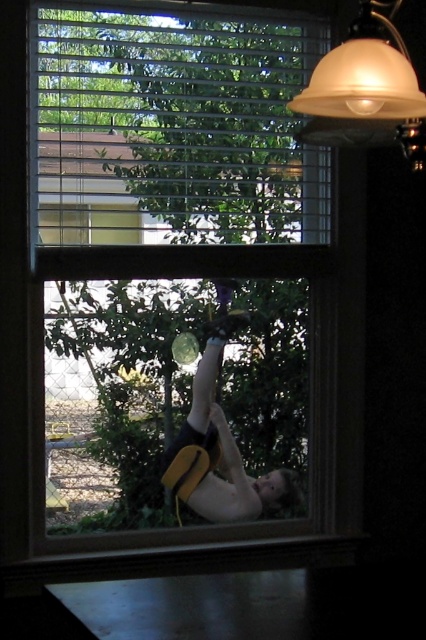
How distant is green wood blinds at upper center from matte white dome at upper right?

green wood blinds at upper center is 27.26 inches away from matte white dome at upper right.

Does green wood blinds at upper center appear over matte white dome at upper right?

Yes, green wood blinds at upper center is above matte white dome at upper right.

This screenshot has width=426, height=640. What are the coordinates of `green wood blinds at upper center` in the screenshot? It's located at (175, 125).

Is matte white dome at upper right bigger than yellow fabric backpack at center?

Correct, matte white dome at upper right is larger in size than yellow fabric backpack at center.

Between matte white dome at upper right and yellow fabric backpack at center, which one appears on the left side from the viewer's perspective?

yellow fabric backpack at center

Describe the element at coordinates (365, 92) in the screenshot. This screenshot has width=426, height=640. I see `matte white dome at upper right` at that location.

Where is `matte white dome at upper right`? The image size is (426, 640). matte white dome at upper right is located at coordinates (365, 92).

Between point (54, 86) and point (166, 468), which one is positioned behind?

The point (166, 468) is behind.

Which is more to the right, green wood blinds at upper center or yellow fabric backpack at center?

Positioned to the right is yellow fabric backpack at center.

Consider the image. Who is more distant from viewer, (256, 243) or (204, 454)?

Positioned behind is point (204, 454).

This screenshot has height=640, width=426. I want to click on green wood blinds at upper center, so click(175, 125).